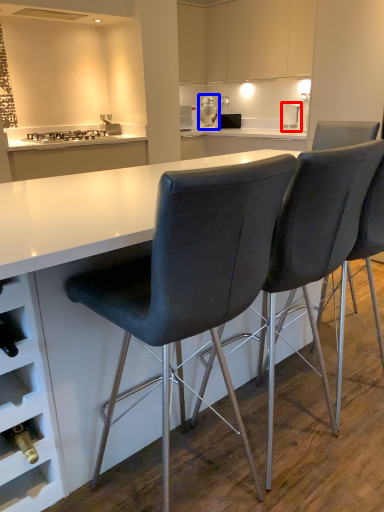
Question: Which object appears farthest to the camera in this image, kitchen appliance (highlighted by a red box) or appliance (highlighted by a blue box)?

Choices:
 (A) kitchen appliance
 (B) appliance

Answer: (B)